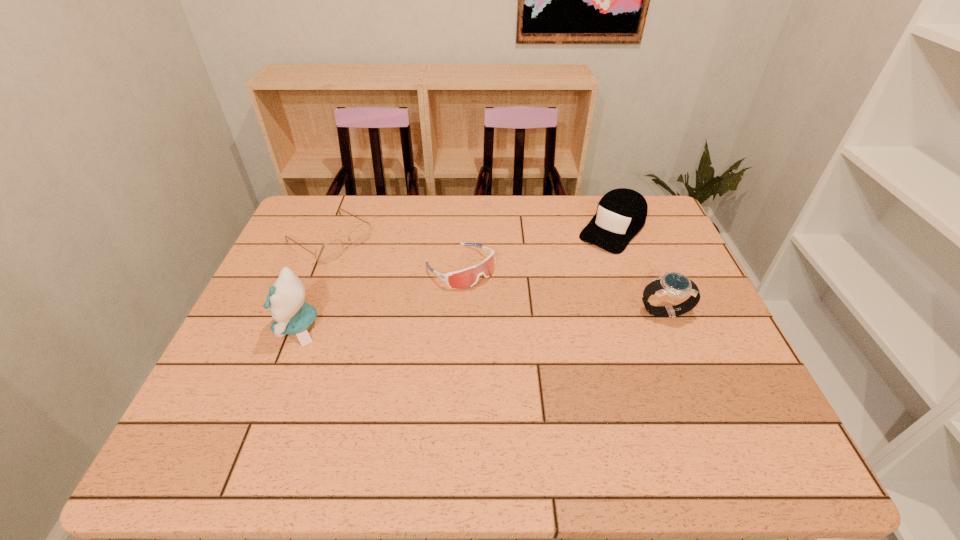
You are a GUI agent. You are given a task and a screenshot of the screen. Output one action in this format:
    pyautogui.click(x=<x>, y=<y>)
    Task: Click on the free space that is in between the third object from right to left and the watch
    
    Given the screenshot: What is the action you would take?
    pyautogui.click(x=562, y=289)

Where is `empty space that is in between the goggles and the watch`? empty space that is in between the goggles and the watch is located at coordinates (562, 289).

Where is `free space that is in between the spectacles and the tallest object`? The width and height of the screenshot is (960, 540). free space that is in between the spectacles and the tallest object is located at coordinates (314, 282).

The image size is (960, 540). I want to click on vacant area that lies between the watch and the kitten, so click(x=481, y=319).

Image resolution: width=960 pixels, height=540 pixels. What are the coordinates of `vacant region between the cap and the spectacles` in the screenshot? It's located at (471, 234).

You are a GUI agent. You are given a task and a screenshot of the screen. Output one action in this format:
    pyautogui.click(x=<x>, y=<y>)
    Task: Click on the free space between the cap and the spectacles
    The width and height of the screenshot is (960, 540).
    Given the screenshot: What is the action you would take?
    pyautogui.click(x=471, y=234)

The image size is (960, 540). Identify the location of vacant point located between the cap and the watch. (638, 270).

The height and width of the screenshot is (540, 960). I want to click on free space between the cap and the fourth tallest object, so click(537, 248).

What are the coordinates of `free area in between the goggles and the cap` in the screenshot? It's located at (537, 248).

Where is `object identified as the second closest to the shortest object`? The height and width of the screenshot is (540, 960). object identified as the second closest to the shortest object is located at coordinates (465, 278).